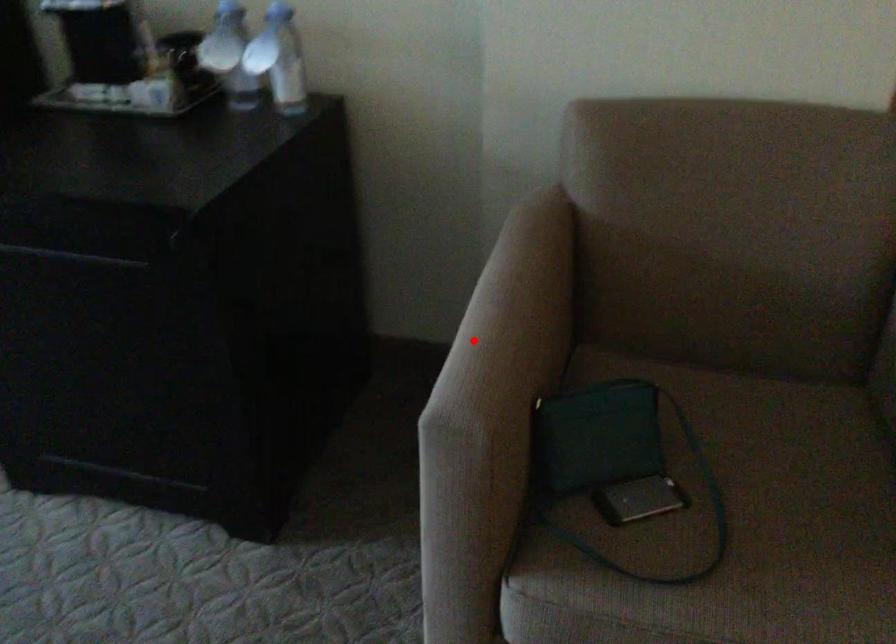
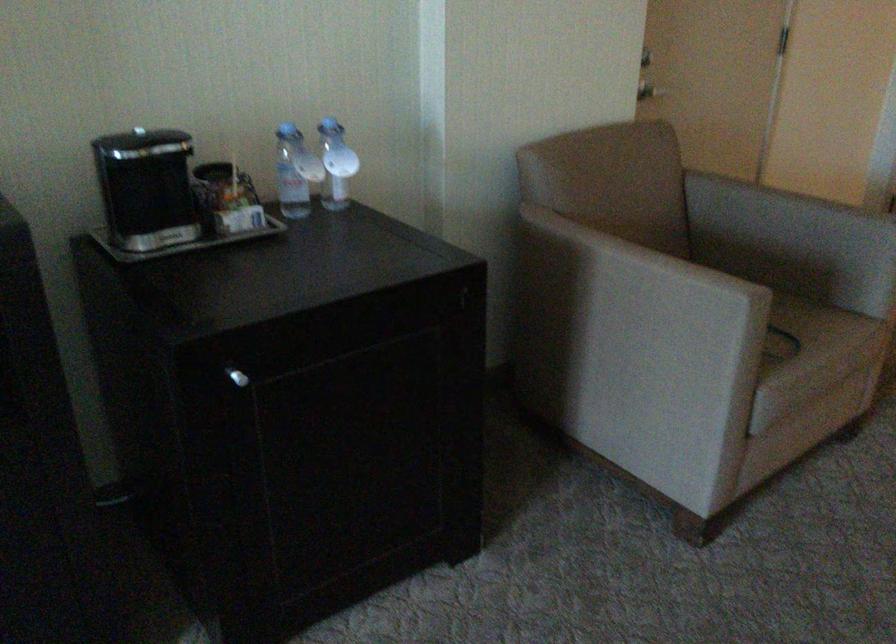
Question: I am providing you with two images of the same scene from different viewpoints. A red point is shown in image1. For the corresponding object point in image2, is it positioned nearer or farther from the camera?

Choices:
 (A) Nearer
 (B) Farther

Answer: (B)